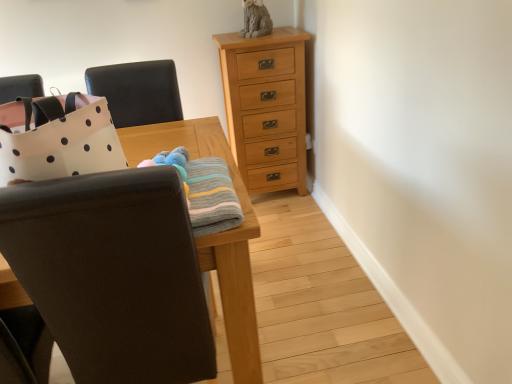
Question: Are black leather chair at upper left, the 2th chair ordered from the bottom, and knitted woolen blanket at center making contact?

Choices:
 (A) no
 (B) yes

Answer: (A)

Question: From the image's perspective, is black leather chair at upper left, the 2th chair ordered from the bottom, under knitted woolen blanket at center?

Choices:
 (A) yes
 (B) no

Answer: (B)

Question: Is knitted woolen blanket at center a part of black leather chair at upper left, the 2th chair ordered from the bottom?

Choices:
 (A) no
 (B) yes

Answer: (A)

Question: Can we say black leather chair at upper left, which appears as the 1th chair when viewed from the top, lies outside knitted woolen blanket at center?

Choices:
 (A) no
 (B) yes

Answer: (B)

Question: From the image's perspective, does black leather chair at upper left, the 2th chair ordered from the bottom, appear higher than knitted woolen blanket at center?

Choices:
 (A) no
 (B) yes

Answer: (B)

Question: From a real-world perspective, is black leather chair at upper left, the 2th chair ordered from the bottom, over knitted woolen blanket at center?

Choices:
 (A) no
 (B) yes

Answer: (B)

Question: Could you tell me if knitted woolen blanket at center is turned towards matte black chair at left, the 2th chair viewed from the top?

Choices:
 (A) no
 (B) yes

Answer: (A)

Question: From a real-world perspective, does knitted woolen blanket at center stand above matte black chair at left, which is the first chair from bottom to top?

Choices:
 (A) yes
 (B) no

Answer: (A)

Question: Is knitted woolen blanket at center positioned far away from matte black chair at left, which is the first chair from bottom to top?

Choices:
 (A) no
 (B) yes

Answer: (A)

Question: Can you confirm if knitted woolen blanket at center is smaller than matte black chair at left, which is the first chair from bottom to top?

Choices:
 (A) yes
 (B) no

Answer: (A)

Question: Can you confirm if knitted woolen blanket at center is wider than matte black chair at left, which is the first chair from bottom to top?

Choices:
 (A) yes
 (B) no

Answer: (B)

Question: Is knitted woolen blanket at center next to matte black chair at left, the 2th chair viewed from the top, and touching it?

Choices:
 (A) yes
 (B) no

Answer: (B)

Question: Is the position of matte black chair at left, the 2th chair viewed from the top, less distant than that of natural wood chest of drawers at upper center?

Choices:
 (A) no
 (B) yes

Answer: (B)